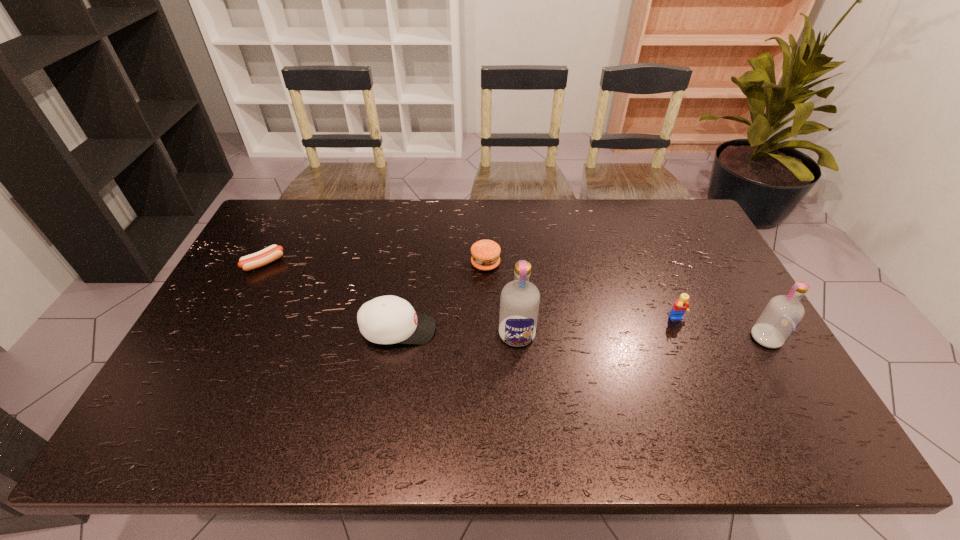
In the image, there is a desktop. Where is `vacant space at the far right corner`? Image resolution: width=960 pixels, height=540 pixels. vacant space at the far right corner is located at coordinates (675, 214).

In order to click on unoccupied area between the fifth shortest object and the Lego in this screenshot , I will do `click(722, 329)`.

This screenshot has height=540, width=960. I want to click on empty space that is in between the left vodka and the rightmost object, so click(x=641, y=336).

Locate an element on the screen. free area in between the fifth object from right to left and the patty is located at coordinates [x=442, y=297].

Locate an element on the screen. This screenshot has height=540, width=960. free point between the leftmost object and the Lego is located at coordinates (470, 292).

Where is `free spot between the Lego and the fifth object from right to left`? The width and height of the screenshot is (960, 540). free spot between the Lego and the fifth object from right to left is located at coordinates (538, 325).

Identify the location of free space between the patty and the Lego. (581, 292).

At what (x,y) coordinates should I click in order to perform the action: click on vacant space that's between the right vodka and the left vodka. Please return your answer as a coordinate pair (x, y). Looking at the image, I should click on (641, 336).

I want to click on object that stands as the fifth closest to the shorter vodka, so click(273, 252).

Locate an element on the screen. The image size is (960, 540). object that stands as the second closest to the sausage is located at coordinates (485, 253).